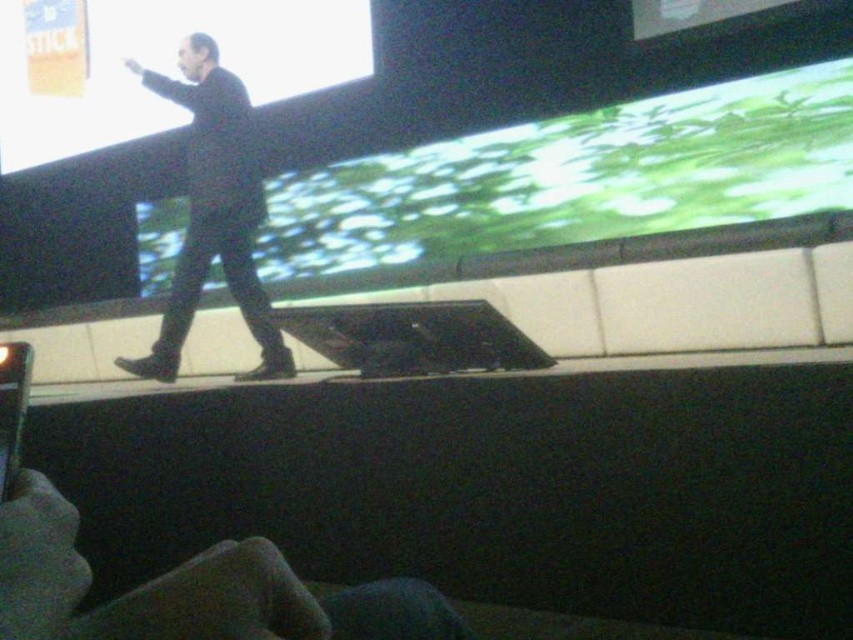
Does matte black screen at upper center appear on the left side of black matte suit at center?

Yes, matte black screen at upper center is to the left of black matte suit at center.

Which is above, matte black screen at upper center or black matte suit at center?

matte black screen at upper center is above.

Image resolution: width=853 pixels, height=640 pixels. What do you see at coordinates (155, 64) in the screenshot?
I see `matte black screen at upper center` at bounding box center [155, 64].

Locate an element on the screen. This screenshot has height=640, width=853. matte black screen at upper center is located at coordinates (155, 64).

Which is below, green matte projection screen at upper center or black matte suit at center?

black matte suit at center is below.

The height and width of the screenshot is (640, 853). Find the location of `green matte projection screen at upper center`. green matte projection screen at upper center is located at coordinates (573, 179).

At what (x,y) coordinates should I click in order to perform the action: click on green matte projection screen at upper center. Please return your answer as a coordinate pair (x, y). This screenshot has width=853, height=640. Looking at the image, I should click on (573, 179).

Looking at this image, is green matte projection screen at upper center shorter than matte black screen at upper center?

Yes, green matte projection screen at upper center is shorter than matte black screen at upper center.

Who is shorter, green matte projection screen at upper center or matte black screen at upper center?

green matte projection screen at upper center is shorter.

Between point (282, 196) and point (1, 99), which one is positioned behind?

The point (1, 99) is behind.

The width and height of the screenshot is (853, 640). Identify the location of green matte projection screen at upper center. (573, 179).